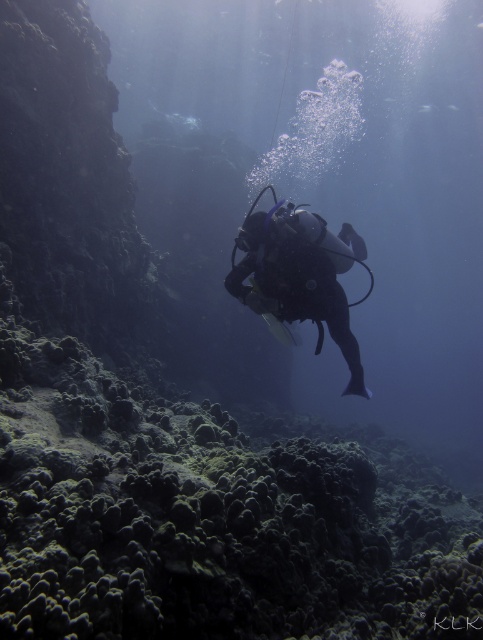
Question: Which object appears closest to the camera in this image?

Choices:
 (A) matte black scuba diver at center
 (B) green textured coral reef at center

Answer: (B)

Question: Is green textured coral reef at center bigger than matte black scuba diver at center?

Choices:
 (A) no
 (B) yes

Answer: (B)

Question: Can you confirm if green textured coral reef at center is wider than matte black scuba diver at center?

Choices:
 (A) yes
 (B) no

Answer: (A)

Question: Which point is farther to the camera?

Choices:
 (A) green textured coral reef at center
 (B) matte black scuba diver at center

Answer: (B)

Question: Can you confirm if green textured coral reef at center is positioned to the right of matte black scuba diver at center?

Choices:
 (A) yes
 (B) no

Answer: (B)